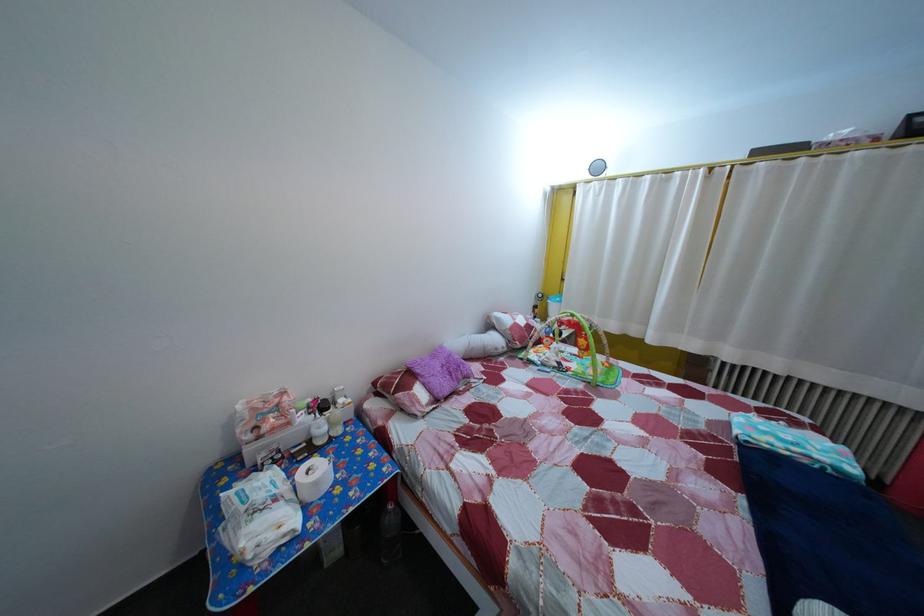
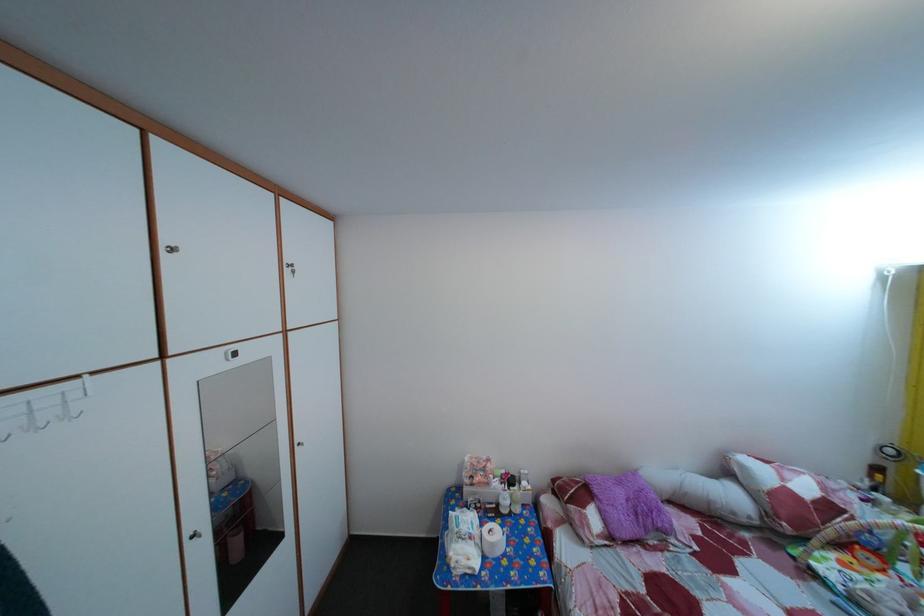
Locate, in the second image, the point that corresponds to the point at 325,491 in the first image.

(502, 553)